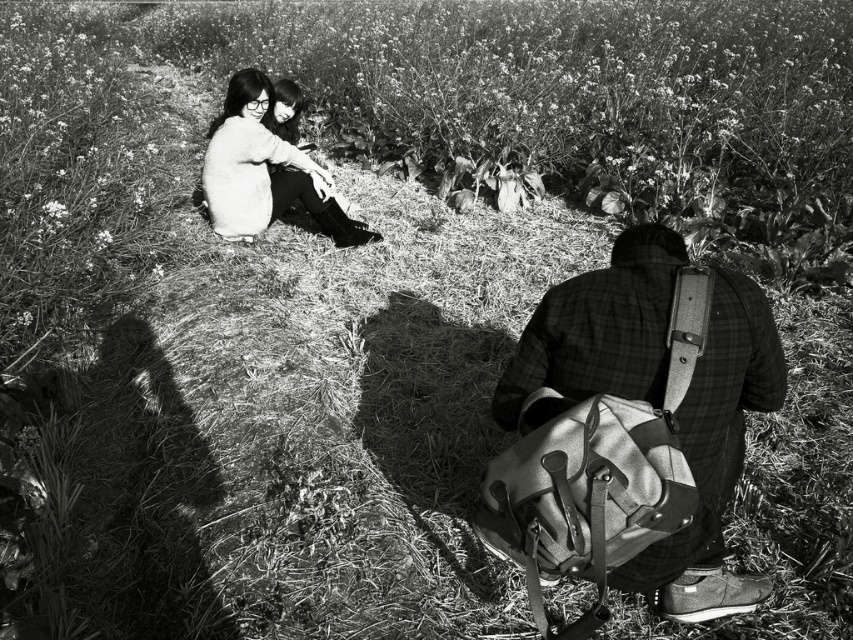
You are trying to decide which clothing item to take for a hike. You see the plaid fabric shirt at lower right and the soft white sweater at upper left in the image. Based on their sizes in the photo, which one might be more suitable if you need something that covers a larger area?

The soft white sweater at upper left has a greater width than the plaid fabric shirt at lower right, so it would be more suitable for covering a larger area.

Based on the scene description, where exactly is the plaid fabric shirt at lower right located in the image?

The plaid fabric shirt at lower right is located at point (715, 458).

In the image, there is a point located at coordinates (715,458). Which object from the scene does this point belong to?

The point at coordinates (715,458) is on the plaid fabric shirt at lower right.